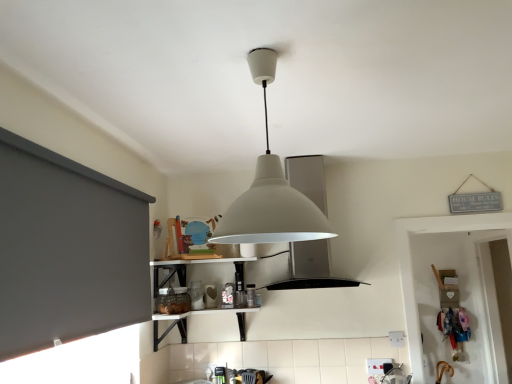
Question: Looking at the image, does dark gray matte window screen at left seem bigger or smaller compared to white matte vent at center?

Choices:
 (A) small
 (B) big

Answer: (A)

Question: From the image's perspective, relative to white matte vent at center, is dark gray matte window screen at left above or below?

Choices:
 (A) above
 (B) below

Answer: (B)

Question: Considering the real-world distances, which object is closest to the white matte vent at center?

Choices:
 (A) dark gray matte window screen at left
 (B) white matte lampshade at center

Answer: (A)

Question: Based on their relative distances, which object is nearer to the dark gray matte window screen at left?

Choices:
 (A) white matte lampshade at center
 (B) white matte vent at center

Answer: (A)